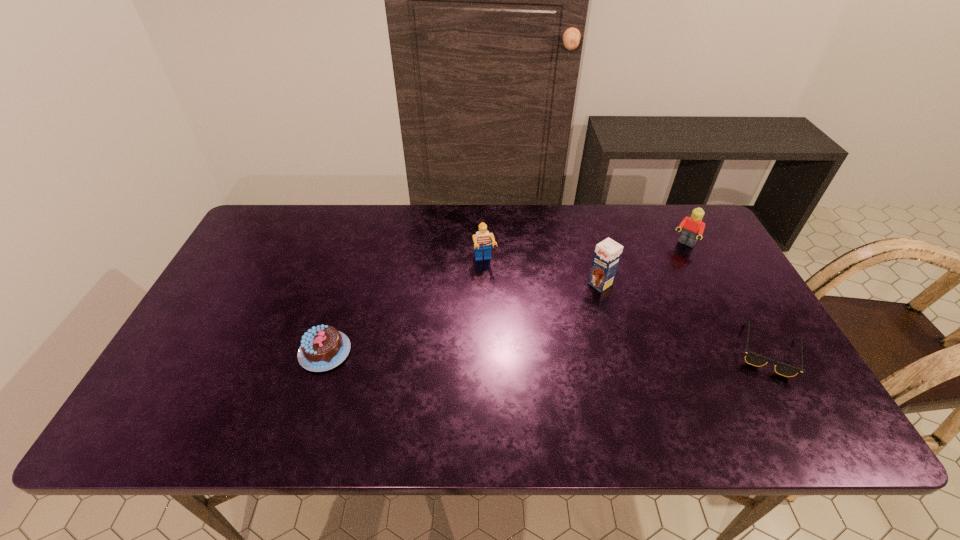
Where is `free area in between the tallest object and the chocolate cake`? The image size is (960, 540). free area in between the tallest object and the chocolate cake is located at coordinates (463, 318).

Identify which object is the second nearest to the right Lego. Please provide its 2D coordinates. Your answer should be formatted as a tuple, i.e. [(x, y)], where the tuple contains the x and y coordinates of a point satisfying the conditions above.

[(752, 358)]

Select which object is the closest to the second object from left to right. Please provide its 2D coordinates. Your answer should be formatted as a tuple, i.e. [(x, y)], where the tuple contains the x and y coordinates of a point satisfying the conditions above.

[(607, 254)]

The height and width of the screenshot is (540, 960). I want to click on free space that satisfies the following two spatial constraints: 1. on the back side of the second shortest object; 2. on the right side of the fourth object from right to left, so click(352, 262).

The width and height of the screenshot is (960, 540). Find the location of `free spot that satisfies the following two spatial constraints: 1. on the back side of the farther Lego; 2. on the right side of the second farthest object`. free spot that satisfies the following two spatial constraints: 1. on the back side of the farther Lego; 2. on the right side of the second farthest object is located at coordinates (485, 244).

I want to click on blank space that satisfies the following two spatial constraints: 1. on the back side of the third object from left to right; 2. on the right side of the right Lego, so click(x=589, y=244).